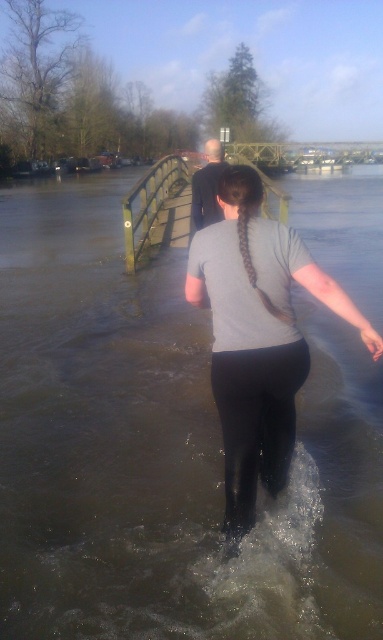
You are a photographer trying to capture the woman in the gray matte shirt at center. You are positioned at point (256, 337). Can you see her clearly?

The gray matte shirt at center is located at point (256, 337), so if you are positioned there, you would be directly at the location of the shirt, making it impossible to see the woman clearly from that spot.

You are a photographer trying to capture the scene of the two people walking towards the wooden bridge. You want to ensure both points, point (328, 301) and point (206, 172), are in focus. Which point should you focus on first to ensure the foreground is sharp?

Point (328, 301) is closer to the camera than point (206, 172), so you should focus on point (328, 301) first to ensure the foreground is sharp.